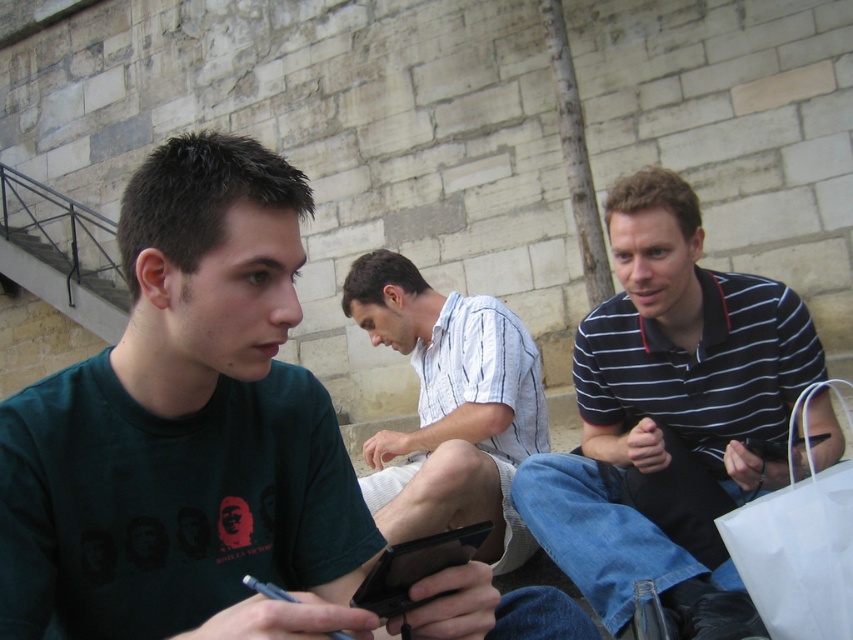
You are organizing a picnic and need to decide which item to place between two baskets. The white striped shirt at center and the white paper bag at lower right are both on the table. Which item has a greater width, making it suitable to be placed between the baskets for stability?

The white striped shirt at center has a greater width than the white paper bag at lower right, so it is suitable to be placed between the baskets for stability.

You are standing at the point with coordinates point (804, 451). You want to move to the point with coordinates point (491, 481). Which direction should you move in?

You should move downward and to the right because point (491, 481) is behind point (804, 451).

You are a photographer taking a group photo of the striped cotton shirt at right and the white striped shirt at center. Which one should you adjust to ensure both are in the frame? Explain your reasoning.

The striped cotton shirt at right is located above the white striped shirt at center. To ensure both are in the frame, you should adjust the camera angle to include the striped cotton shirt at right which is higher up.